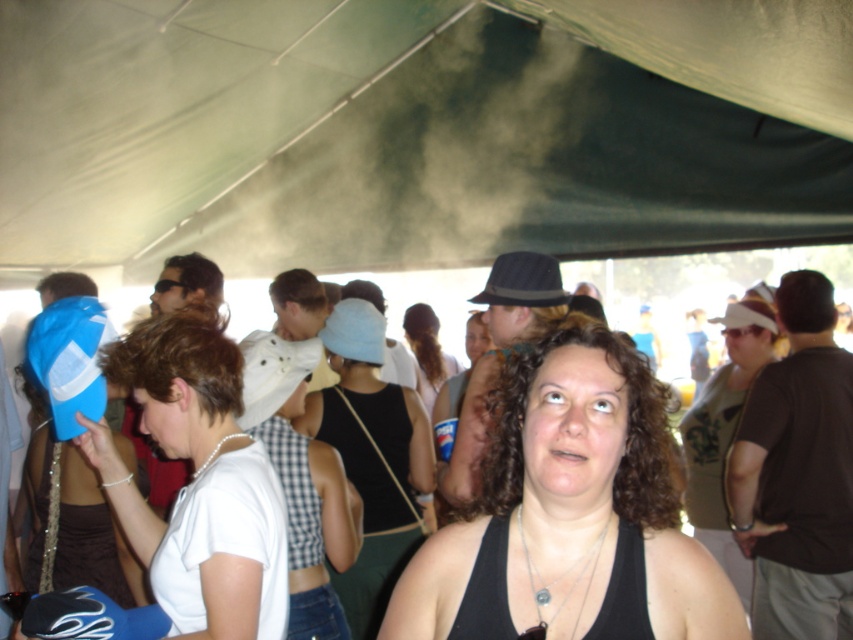
Does white matte baseball cap at left have a lesser width compared to white fabric hat at center?

In fact, white matte baseball cap at left might be wider than white fabric hat at center.

Does white matte baseball cap at left appear under white fabric hat at center?

Result: Indeed, white matte baseball cap at left is positioned under white fabric hat at center.

You are a GUI agent. You are given a task and a screenshot of the screen. Output one action in this format:
    pyautogui.click(x=<x>, y=<y>)
    Task: Click on the white matte baseball cap at left
    
    Given the screenshot: What is the action you would take?
    pyautogui.click(x=196, y=483)

In the scene shown: Is black tank top at center above matte white tank top at center?

Yes, black tank top at center is above matte white tank top at center.

Who is higher up, black tank top at center or matte white tank top at center?

black tank top at center is higher up.

Which is behind, point (436, 616) or point (722, 481)?

The point (722, 481) is behind.

The width and height of the screenshot is (853, 640). Identify the location of black tank top at center. (569, 515).

Does matte white tank top at center appear over white fabric hat at center?

No.

Can you confirm if matte white tank top at center is bigger than white fabric hat at center?

Indeed, matte white tank top at center has a larger size compared to white fabric hat at center.

Is point (747, 340) more distant than point (409, 321)?

No, it is in front of (409, 321).

The height and width of the screenshot is (640, 853). I want to click on matte white tank top at center, so click(x=724, y=433).